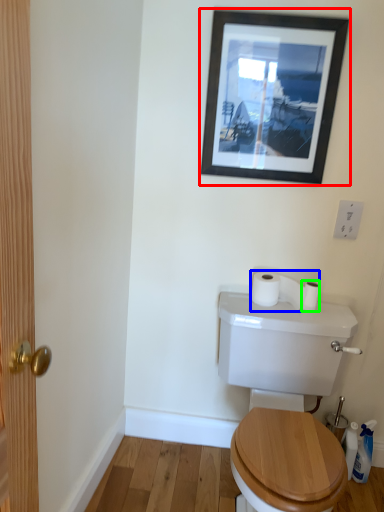
Question: Which object is the closest to the picture frame (highlighted by a red box)? Choose among these: toilet paper (highlighted by a blue box) or toilet paper (highlighted by a green box).

Choices:
 (A) toilet paper
 (B) toilet paper

Answer: (A)